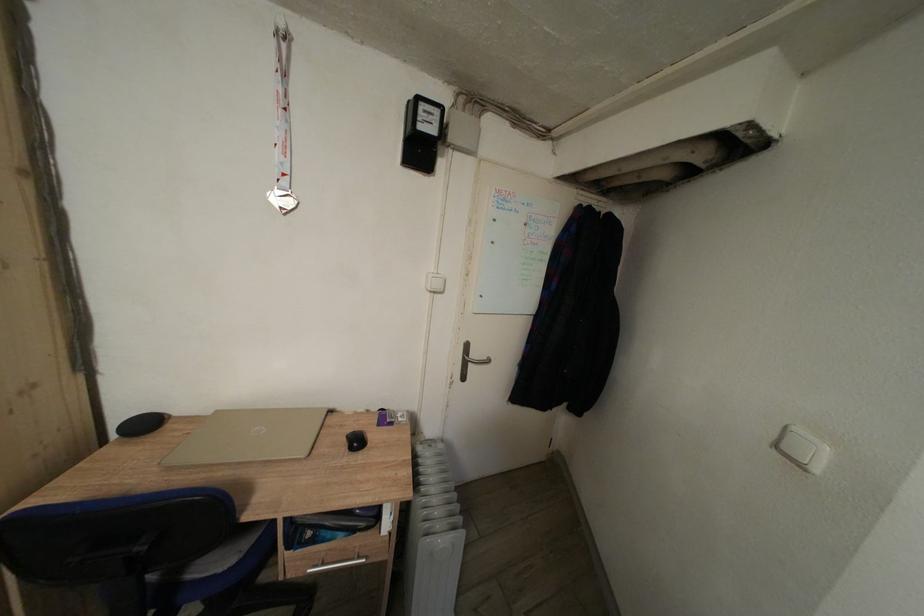
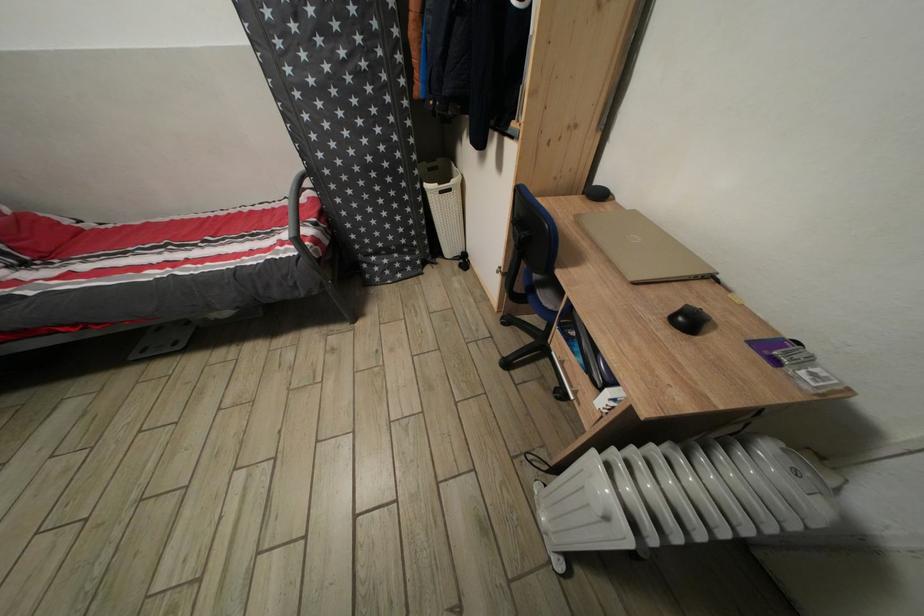
The point at (224, 419) is marked in the first image. Where is the corresponding point in the second image?

(641, 217)